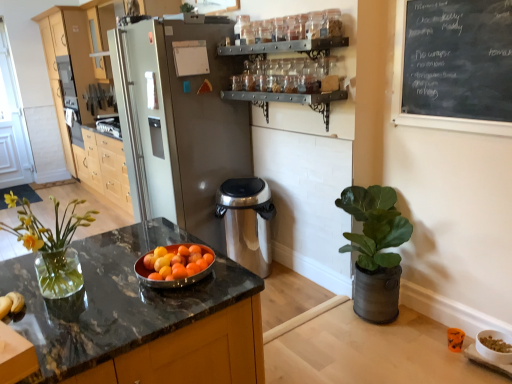
Locate an element on the screen. Image resolution: width=512 pixels, height=384 pixels. free point below clear glass vase at left (from a real-world perspective) is located at coordinates (72, 294).